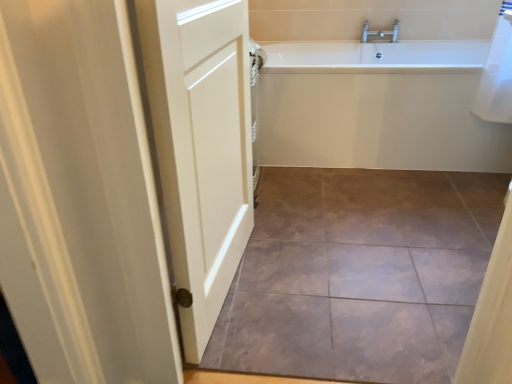
Question: Considering the relative sizes of white glossy bathtub at upper right and white matte door at left in the image provided, is white glossy bathtub at upper right bigger than white matte door at left?

Choices:
 (A) yes
 (B) no

Answer: (A)

Question: Is white glossy bathtub at upper right to the left of white matte door at left from the viewer's perspective?

Choices:
 (A) yes
 (B) no

Answer: (B)

Question: Is white glossy bathtub at upper right thinner than white matte door at left?

Choices:
 (A) no
 (B) yes

Answer: (A)

Question: Is the surface of white glossy bathtub at upper right in direct contact with white matte door at left?

Choices:
 (A) no
 (B) yes

Answer: (A)

Question: From a real-world perspective, is white glossy bathtub at upper right physically above white matte door at left?

Choices:
 (A) no
 (B) yes

Answer: (A)

Question: Is white glossy bathtub at upper right taller than white matte door at left?

Choices:
 (A) no
 (B) yes

Answer: (A)

Question: From a real-world perspective, does white matte door at left sit lower than brown textured tile at center?

Choices:
 (A) yes
 (B) no

Answer: (B)

Question: Can you confirm if white matte door at left is smaller than brown textured tile at center?

Choices:
 (A) yes
 (B) no

Answer: (B)

Question: Can you see white matte door at left touching brown textured tile at center?

Choices:
 (A) yes
 (B) no

Answer: (B)

Question: Is white matte door at left taller than brown textured tile at center?

Choices:
 (A) yes
 (B) no

Answer: (A)

Question: From the image's perspective, does white matte door at left appear higher than brown textured tile at center?

Choices:
 (A) no
 (B) yes

Answer: (B)

Question: Considering the relative sizes of white matte door at left and brown textured tile at center in the image provided, is white matte door at left wider than brown textured tile at center?

Choices:
 (A) no
 (B) yes

Answer: (A)

Question: Can you confirm if brown textured tile at center is wider than white matte door at left?

Choices:
 (A) no
 (B) yes

Answer: (B)